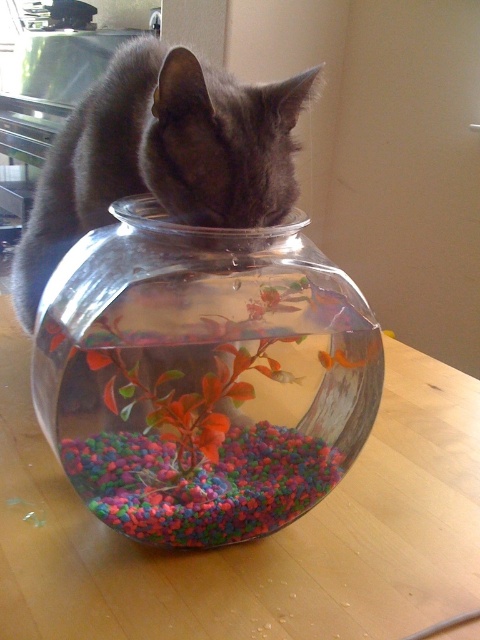
You are a pet owner who wants to ensure the safety of your orange matte fish at center. The fishbowl is made of transparent glass bowl at center. Based on the scene, is the fishbowl properly placed to prevent the fish from jumping out?

The transparent glass bowl at center is located above orange matte fish at center, which means the fishbowl has sufficient depth to prevent the fish from jumping out.

You are standing in the room and want to place a new decorative item on the wooden table at center. Based on the scene description, where exactly should you place it?

The wooden table at center is located at point 2D coordinates of (x=257, y=540), so you should place the new decorative item at that position.